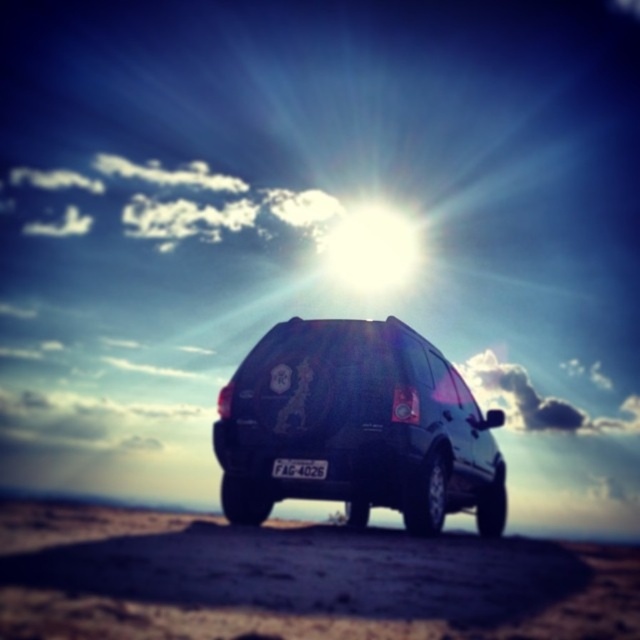
Can you confirm if sandy/dry sand at center is taller than white plastic license plate at center?

No, sandy/dry sand at center is not taller than white plastic license plate at center.

Does point (456, 566) come in front of point (292, 460)?

Yes, it is.

Is point (204, 579) farther from viewer compared to point (301, 477)?

No, (204, 579) is in front of (301, 477).

The height and width of the screenshot is (640, 640). I want to click on sandy/dry sand at center, so click(296, 579).

Identify the location of sandy/dry sand at center. The image size is (640, 640). (296, 579).

Does point (77, 564) come farther from viewer compared to point (464, 506)?

No, (77, 564) is closer to viewer.

The height and width of the screenshot is (640, 640). Describe the element at coordinates (296, 579) in the screenshot. I see `sandy/dry sand at center` at that location.

At what (x,y) coordinates should I click in order to perform the action: click on sandy/dry sand at center. Please return your answer as a coordinate pair (x, y). Looking at the image, I should click on (296, 579).

From the picture: How distant is satin black suv at center from white plastic license plate at center?

satin black suv at center is 35.27 inches away from white plastic license plate at center.

Does satin black suv at center have a greater width compared to white plastic license plate at center?

Indeed, satin black suv at center has a greater width compared to white plastic license plate at center.

I want to click on satin black suv at center, so click(356, 426).